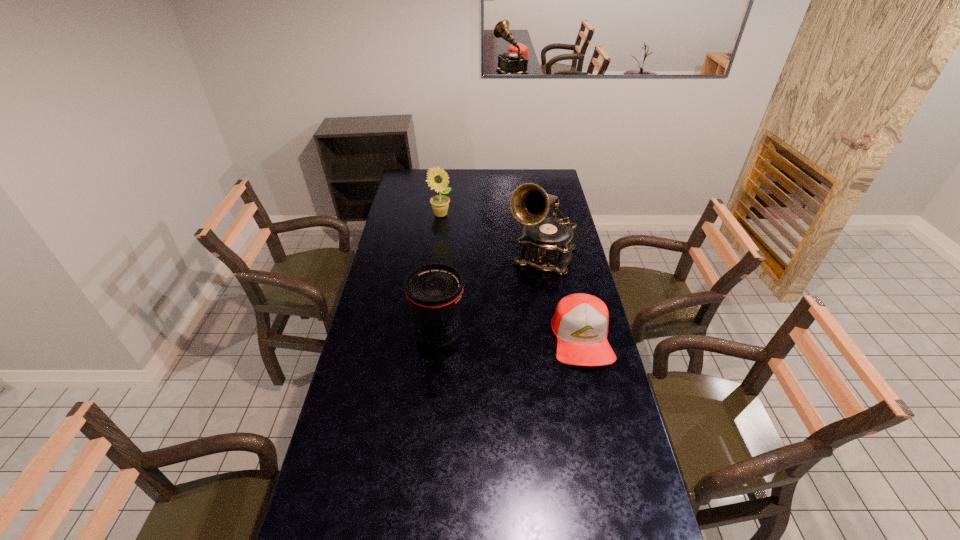
Locate an element on the screen. vacant space positioned on the face of the sunflower is located at coordinates (449, 232).

Locate an element on the screen. The image size is (960, 540). vacant space located on the face of the sunflower is located at coordinates coord(448,230).

The width and height of the screenshot is (960, 540). I want to click on vacant position located 0.130m on the face of the sunflower, so click(x=451, y=234).

At what (x,y) coordinates should I click in order to perform the action: click on baseball cap located at the right edge. Please return your answer as a coordinate pair (x, y). The image size is (960, 540). Looking at the image, I should click on (580, 322).

Find the location of `phonograph record at the right edge`. phonograph record at the right edge is located at coordinates (546, 244).

Locate an element on the screen. The image size is (960, 540). free space at the far edge is located at coordinates pyautogui.click(x=502, y=170).

You are a GUI agent. You are given a task and a screenshot of the screen. Output one action in this format:
    pyautogui.click(x=<x>, y=<y>)
    Task: Click on the vacant space at the near edge of the desktop
    This screenshot has height=540, width=960.
    Given the screenshot: What is the action you would take?
    pyautogui.click(x=568, y=524)

The height and width of the screenshot is (540, 960). What are the coordinates of `vacant position at the left edge of the desktop` in the screenshot? It's located at (381, 287).

The height and width of the screenshot is (540, 960). In order to click on vacant region at the right edge of the desktop in this screenshot , I will do `click(586, 457)`.

Identify the location of free space at the far right corner of the desktop. (540, 174).